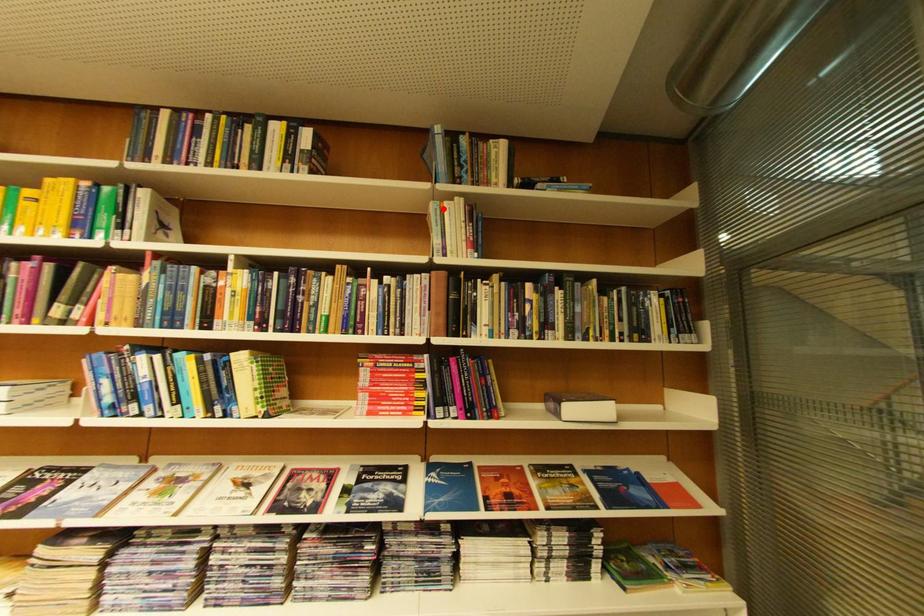
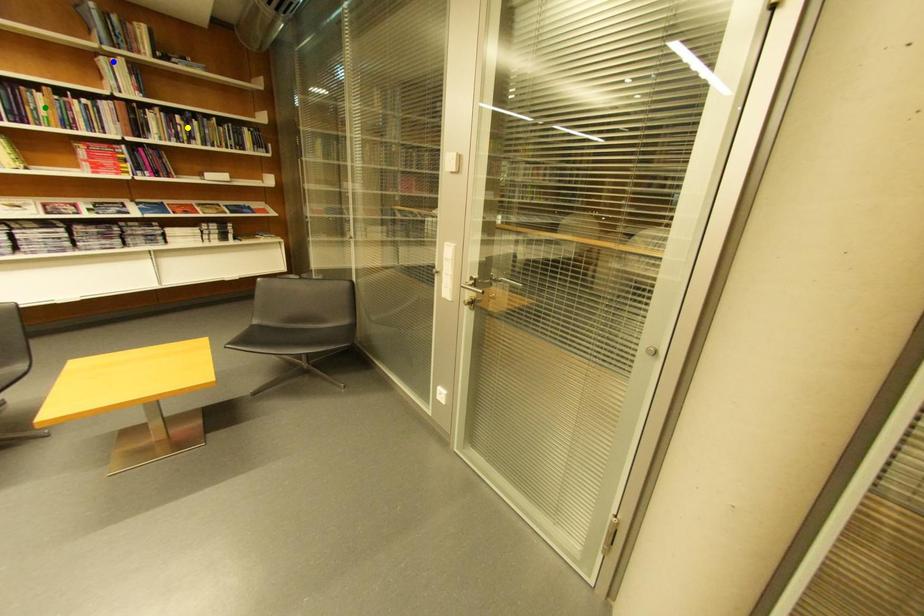
Question: I am providing you with two images of the same scene from different viewpoints. A red point is marked on the first image. You are given multiple points on the second image. Can you choose the point in image 2 that corresponds to the point in image 1?

Choices:
 (A) blue point
 (B) yellow point
 (C) green point

Answer: (A)